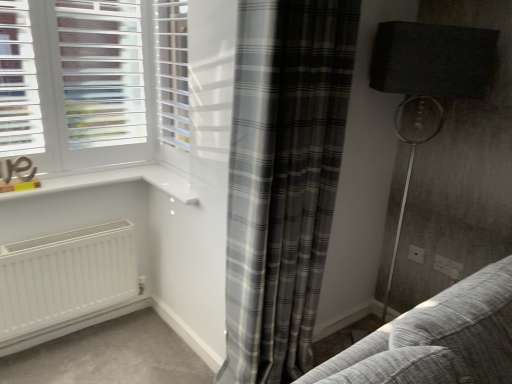
Question: Which is correct: white plastic electric outlet at lower right, acting as the 1th electric outlet starting from the back, is inside matte black lampshade at right, or outside of it?

Choices:
 (A) inside
 (B) outside

Answer: (A)

Question: Considering the positions of point (409, 253) and point (416, 89), is point (409, 253) closer or farther from the camera than point (416, 89)?

Choices:
 (A) farther
 (B) closer

Answer: (A)

Question: Which is farther from the white plastic blinds at upper center?

Choices:
 (A) white plastic electric outlet at lower right, the second electric outlet when ordered from right to left
 (B) matte black lampshade at right
 (C) gray plaid curtain at center
 (D) white plastic electric outlet at lower right, the 1th electric outlet in the front-to-back sequence

Answer: (D)

Question: Which of these objects is positioned farthest from the white plastic electric outlet at lower right, which is the second electric outlet from left to right?

Choices:
 (A) white plastic electric outlet at lower right, acting as the 1th electric outlet starting from the back
 (B) gray plaid curtain at center
 (C) matte black lampshade at right
 (D) white plastic blinds at upper center

Answer: (D)